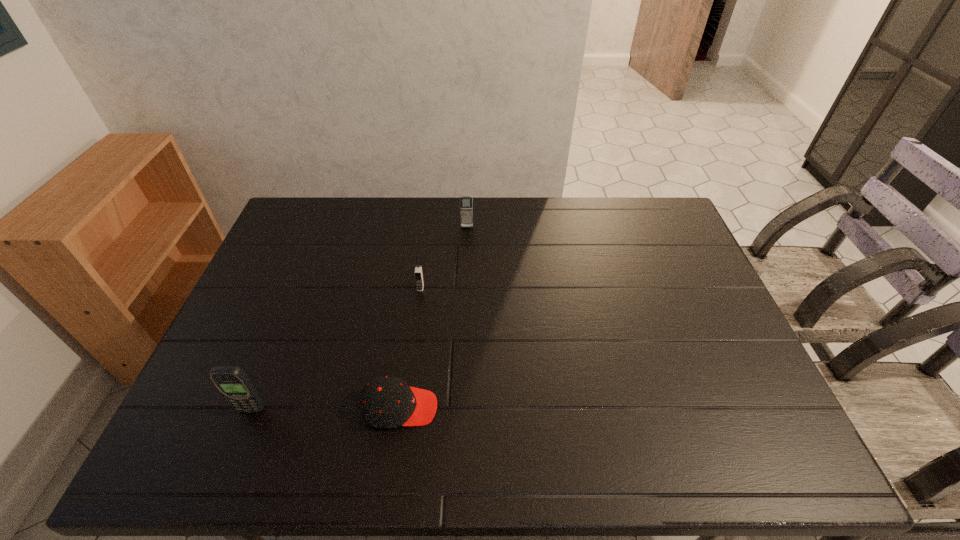
This screenshot has width=960, height=540. I want to click on vacant region located 0.120m on the front-facing side of the cap, so click(487, 408).

Identify the location of object positioned at the far edge. (x=466, y=203).

Locate an element on the screen. Image resolution: width=960 pixels, height=540 pixels. object at the near edge is located at coordinates (387, 402).

At what (x,y) coordinates should I click in order to perform the action: click on object present at the left edge. Please return your answer as a coordinate pair (x, y). This screenshot has height=540, width=960. Looking at the image, I should click on 232,382.

You are a GUI agent. You are given a task and a screenshot of the screen. Output one action in this format:
    pyautogui.click(x=<x>, y=<y>)
    Task: Click on the free space at the far edge
    The image size is (960, 540).
    Given the screenshot: What is the action you would take?
    pyautogui.click(x=511, y=199)

I want to click on free space at the near edge of the desktop, so click(x=571, y=450).

Where is `free space at the left edge of the desktop`? This screenshot has height=540, width=960. free space at the left edge of the desktop is located at coordinates (252, 300).

In the image, there is a desktop. Where is `vacant space at the right edge`? vacant space at the right edge is located at coordinates coord(710,334).

The width and height of the screenshot is (960, 540). What are the coordinates of `vacant area at the far left corner` in the screenshot? It's located at (312, 199).

Image resolution: width=960 pixels, height=540 pixels. I want to click on vacant region at the far right corner of the desktop, so click(x=651, y=197).